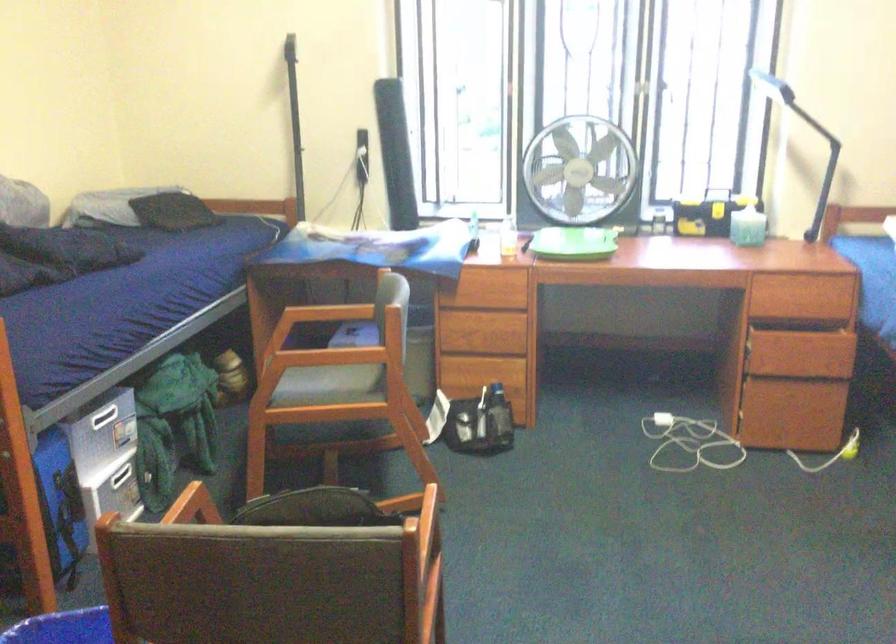
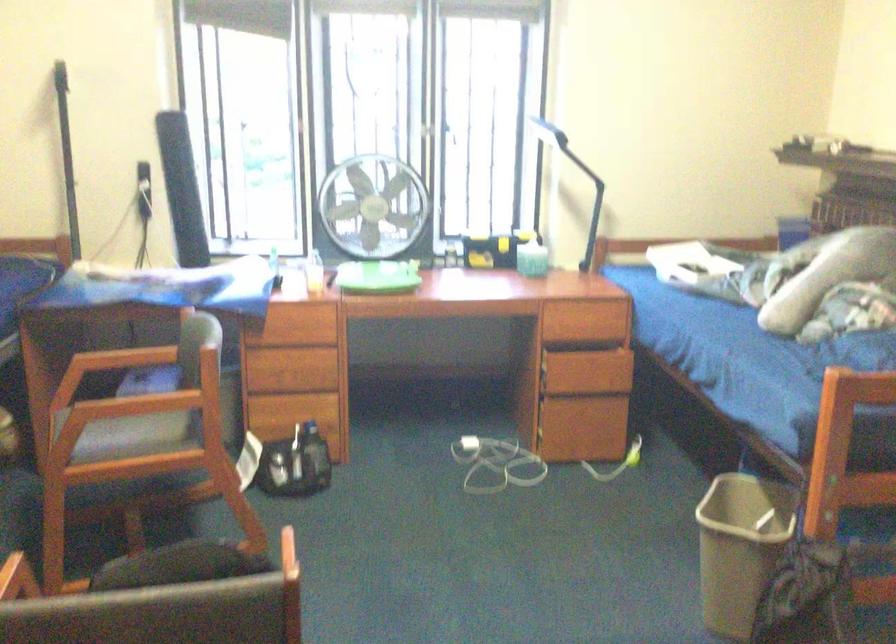
Question: The images are taken continuously from a first-person perspective. In which direction are you moving?

Choices:
 (A) Left
 (B) Right
 (C) Forward
 (D) Backward

Answer: (A)